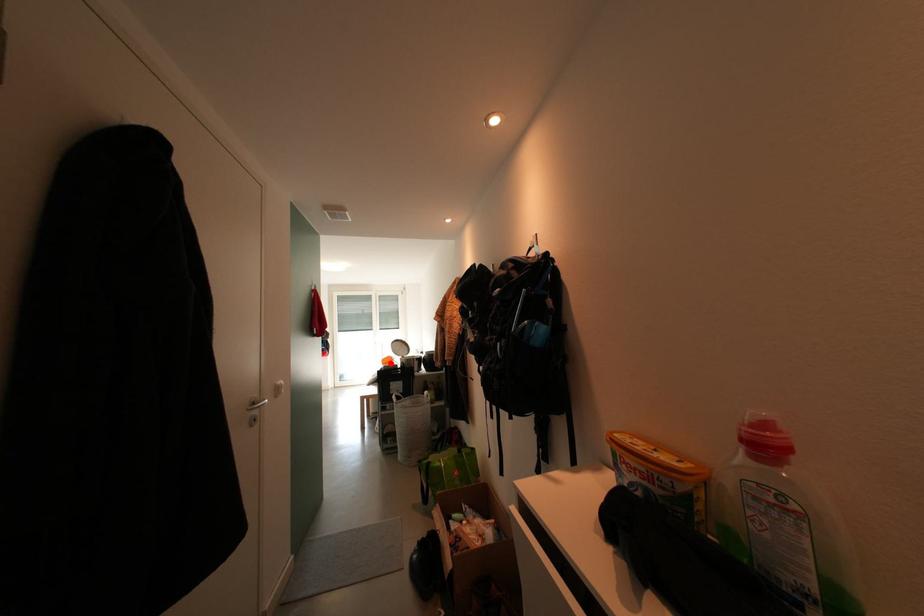
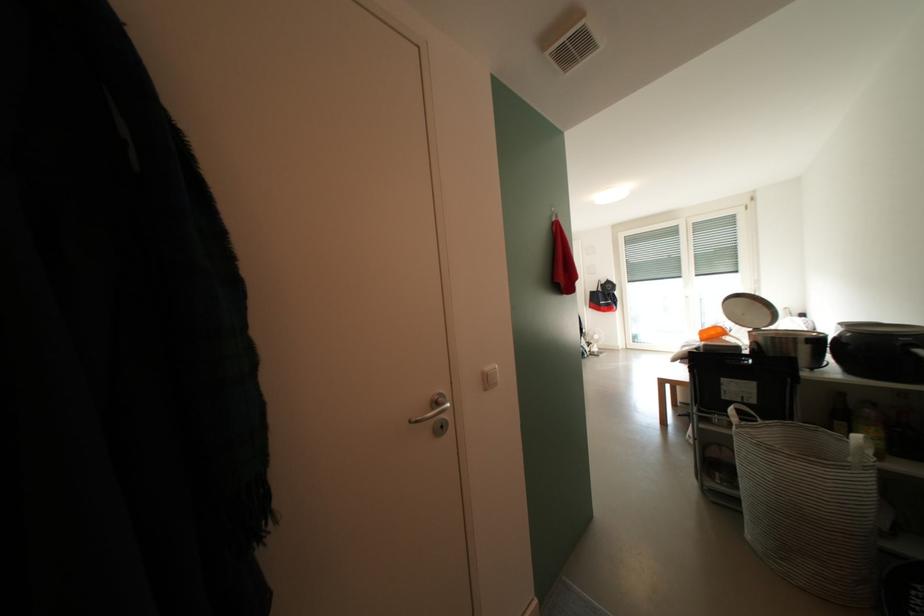
The point at the highlighted location is marked in the first image. Where is the corresponding point in the second image?

(710, 336)